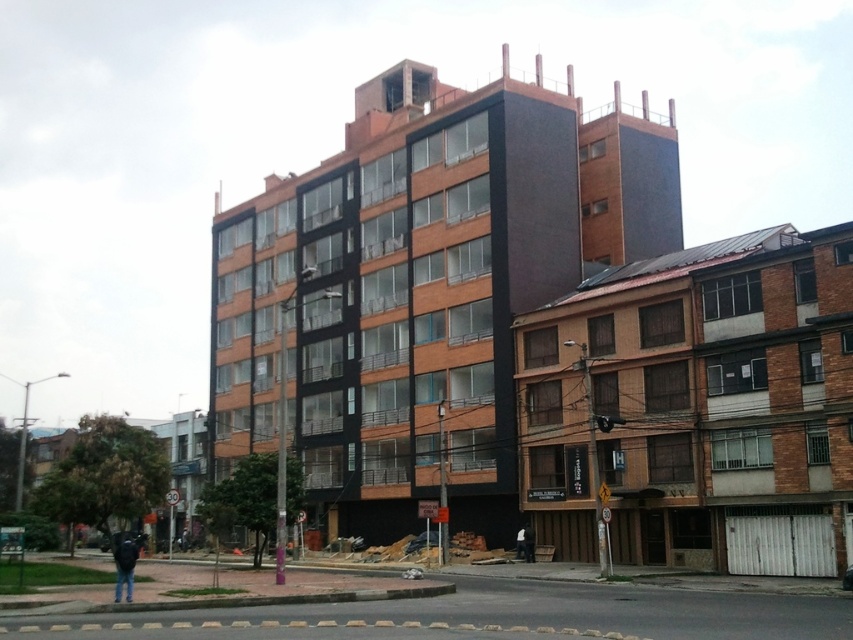
Which is in front, point (368, 406) or point (131, 560)?

Positioned in front is point (131, 560).

Consider the image. Can you confirm if orange brick building at center is taller than dark blue jeans at lower left?

Correct, orange brick building at center is much taller as dark blue jeans at lower left.

Does point (486, 388) lie behind point (117, 545)?

Yes, it is.

What are the coordinates of `orange brick building at center` in the screenshot? It's located at (422, 285).